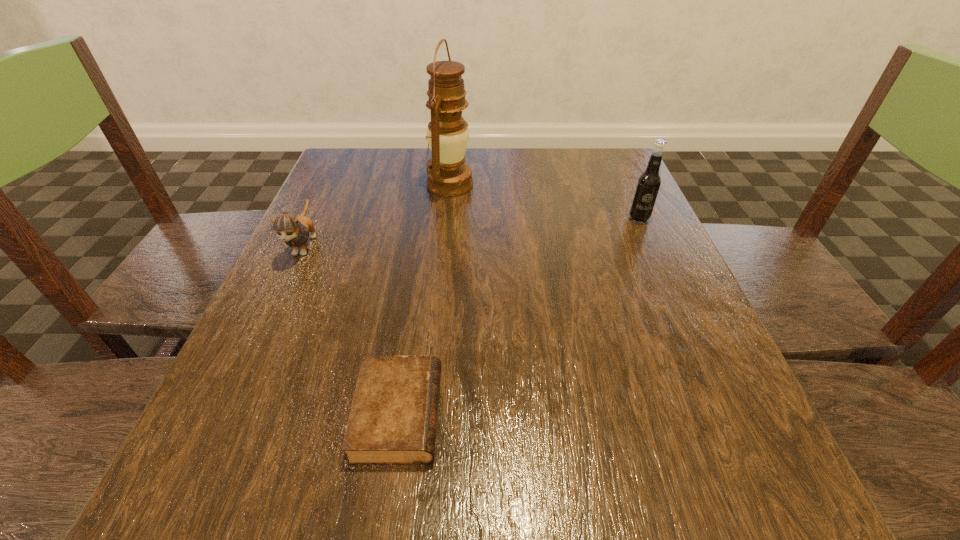
The width and height of the screenshot is (960, 540). What are the coordinates of `oil lamp` in the screenshot? It's located at (448, 175).

What are the coordinates of `the tallest object` in the screenshot? It's located at (448, 175).

The image size is (960, 540). I want to click on root beer, so click(x=648, y=184).

This screenshot has width=960, height=540. What are the coordinates of `the rightmost object` in the screenshot? It's located at (648, 184).

Locate an element on the screen. the leftmost object is located at coordinates (293, 230).

You are a GUI agent. You are given a task and a screenshot of the screen. Output one action in this format:
    pyautogui.click(x=<x>, y=<y>)
    Task: Click on the third tallest object
    The height and width of the screenshot is (540, 960).
    Given the screenshot: What is the action you would take?
    pyautogui.click(x=293, y=230)

Locate an element on the screen. The height and width of the screenshot is (540, 960). diary is located at coordinates (393, 419).

Find the location of a particular element. the nearest object is located at coordinates (393, 419).

You are a GUI agent. You are given a task and a screenshot of the screen. Output one action in this format:
    pyautogui.click(x=<x>, y=<y>)
    Task: Click on the vacant area situated on the right of the tallest object
    The width and height of the screenshot is (960, 540).
    Given the screenshot: What is the action you would take?
    coord(566,185)

Identify the location of free location located 0.090m on the label of the root beer. This screenshot has width=960, height=540. (654, 252).